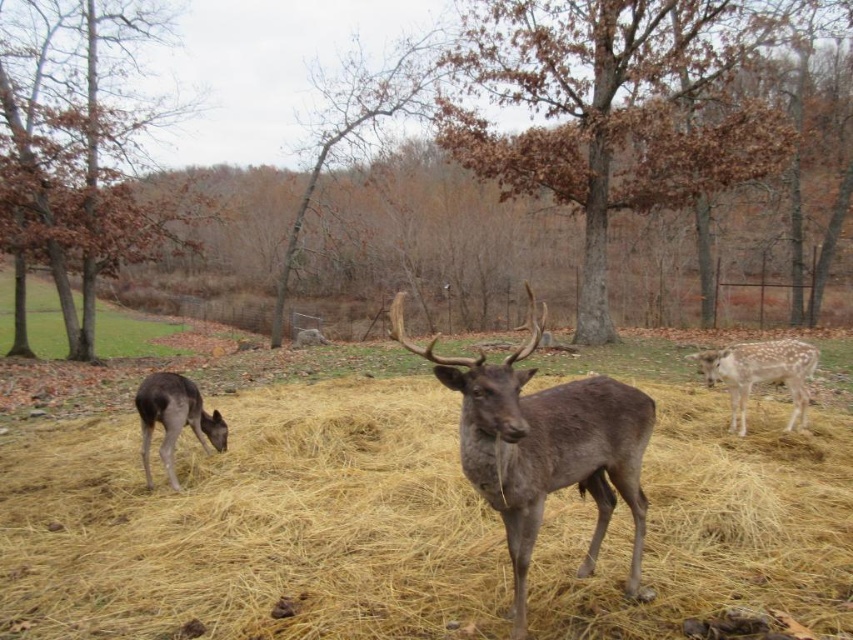
Does brown dry grass at center appear on the right side of gray matte deer at lower left?

Indeed, brown dry grass at center is positioned on the right side of gray matte deer at lower left.

Can you confirm if brown dry grass at center is smaller than gray matte deer at lower left?

Yes.

Is point (279, 454) farther from camera compared to point (175, 413)?

That is True.

I want to click on brown dry grass at center, so click(257, 525).

Which is below, spotted fur deer at right or gray matte deer at lower left?

Positioned lower is gray matte deer at lower left.

This screenshot has height=640, width=853. Find the location of `spotted fur deer at right`. spotted fur deer at right is located at coordinates (759, 374).

This screenshot has height=640, width=853. I want to click on spotted fur deer at right, so click(759, 374).

The height and width of the screenshot is (640, 853). What are the coordinates of `green grass at lower left` in the screenshot? It's located at (135, 333).

Between point (9, 278) and point (775, 378), which one is positioned in front?

Positioned in front is point (775, 378).

Where is `green grass at lower left`? The height and width of the screenshot is (640, 853). green grass at lower left is located at coordinates (135, 333).